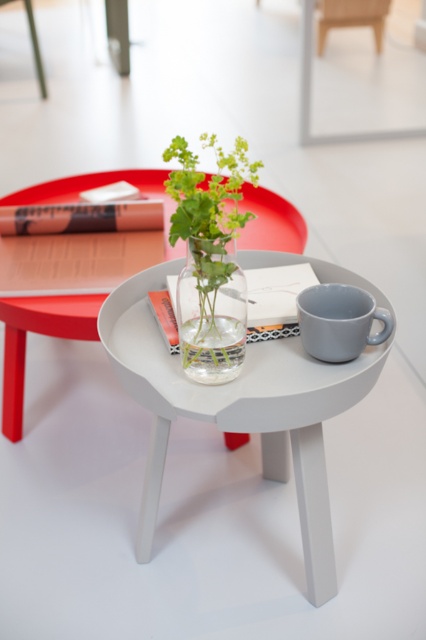
Which is in front, point (218, 282) or point (201, 220)?

Positioned in front is point (201, 220).

Locate an element on the screen. The image size is (426, 640). translucent glass vase at center is located at coordinates (210, 259).

Is point (221, 253) less distant than point (227, 209)?

Yes, it is in front of point (227, 209).

Find the location of a particular element. This screenshot has width=426, height=640. translucent glass vase at center is located at coordinates 210,259.

Does matte white table at center lie behind matte gray mug at lower right?

No, matte white table at center is closer to the viewer.

Which is in front, point (313, 394) or point (385, 314)?

Point (313, 394) is more forward.

Locate an element on the screen. matte white table at center is located at coordinates (239, 410).

Where is `matte white table at center`? matte white table at center is located at coordinates [239, 410].

Measure the distance between matte white table at center and camera.

matte white table at center and camera are 89.19 centimeters apart from each other.

How distant is matte white table at center from translucent glass vase at center?

The distance of matte white table at center from translucent glass vase at center is 9.23 inches.

Between point (253, 376) and point (210, 301), which one is positioned in front?

Point (210, 301) is in front.

This screenshot has width=426, height=640. Identify the location of matte white table at center. (239, 410).